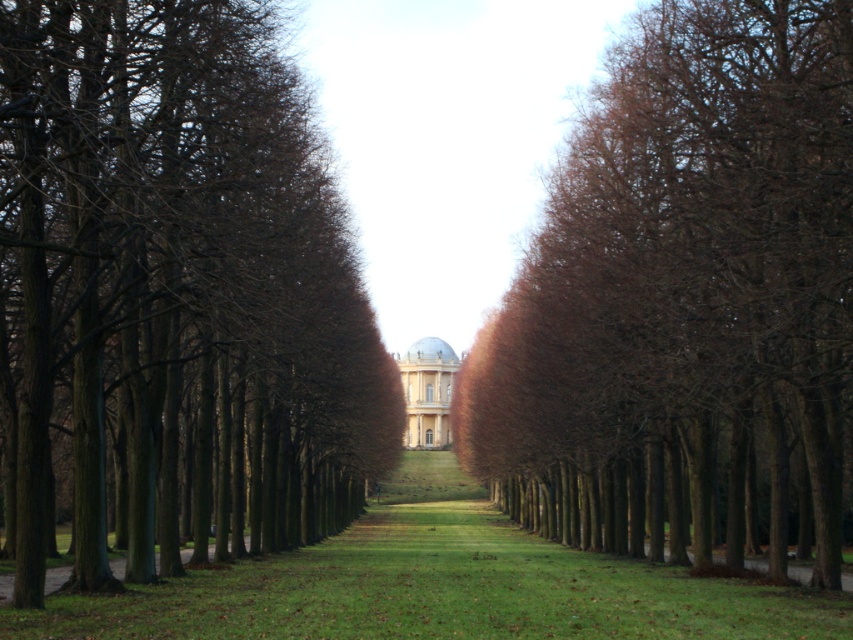
You are standing in front of the grand building and want to take a photo. There are two points marked in the scene, point 1 at coordinates point (9, 168) and point 2 at coordinates point (688, 51). Which point is closer to you?

Point point (9, 168) is closer to the camera than point point (688, 51).

You are standing at the entrance of the grand building and want to walk towards the green grass at center. Which direction should you walk to avoid the brown textured tree at left?

To reach the green grass at center while avoiding the brown textured tree at left, you should walk to the right since the tree is positioned to the left of the grass.